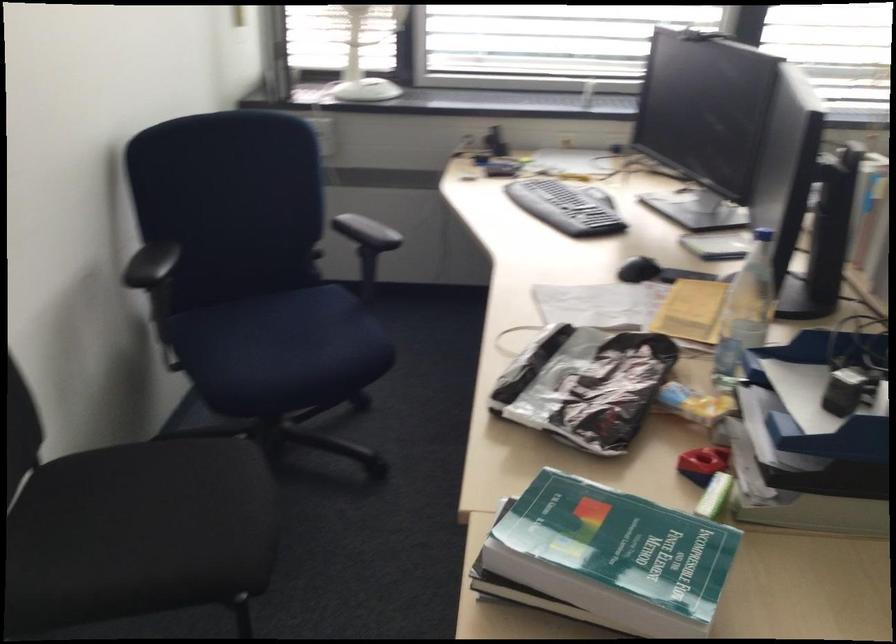
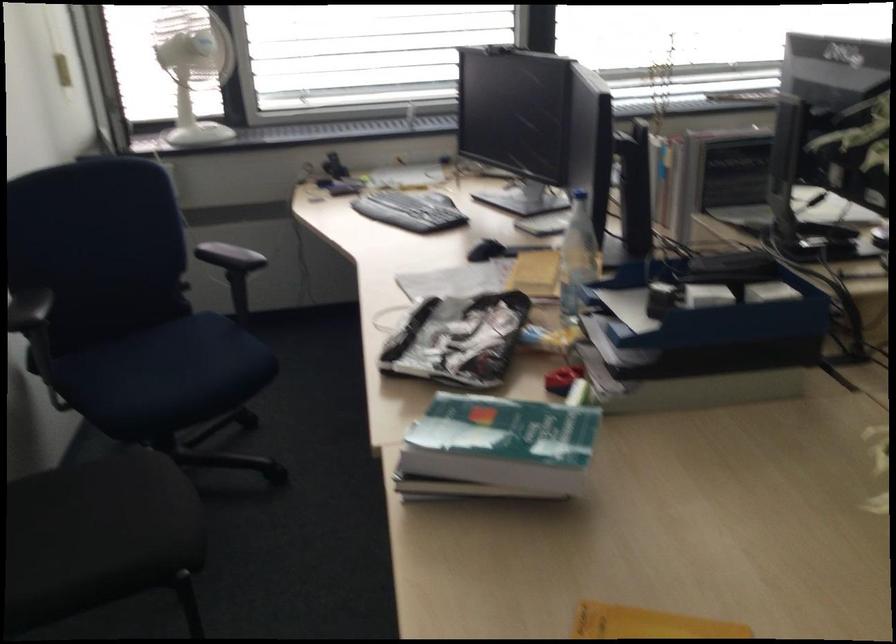
Question: In a continuous first-person perspective shot, in which direction is the camera moving?

Choices:
 (A) Left
 (B) Right
 (C) Forward
 (D) Backward

Answer: (D)